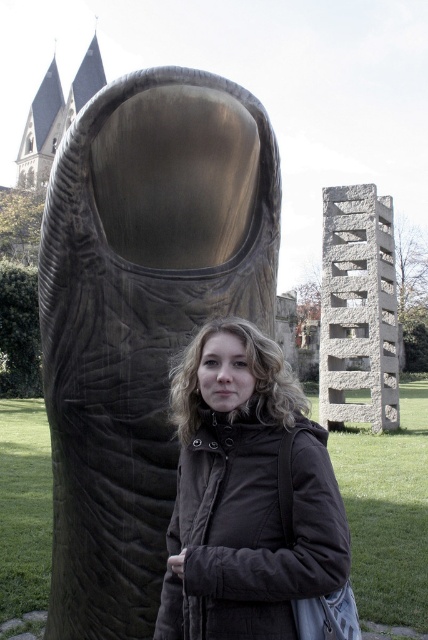
Does bronze textured sculpture at center lie in front of dark brown quilted jacket at center?

No, it is behind dark brown quilted jacket at center.

Between bronze textured sculpture at center and dark brown quilted jacket at center, which one appears on the right side from the viewer's perspective?

dark brown quilted jacket at center

Is point (171, 122) more distant than point (204, 576)?

Yes, it is behind point (204, 576).

I want to click on bronze textured sculpture at center, so click(140, 316).